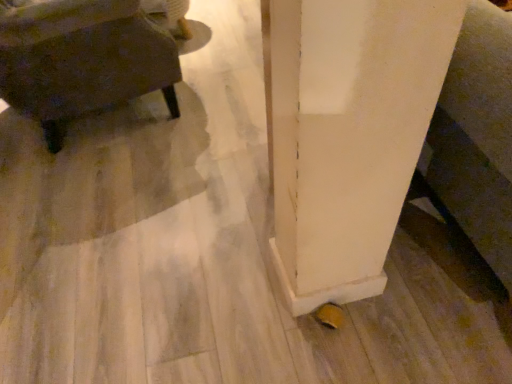
Question: Does white matte pillar at lower right have a smaller size compared to matte dark brown coffee table at left?

Choices:
 (A) no
 (B) yes

Answer: (A)

Question: Is white matte pillar at lower right further to camera compared to matte dark brown coffee table at left?

Choices:
 (A) yes
 (B) no

Answer: (B)

Question: From a real-world perspective, is white matte pillar at lower right below matte dark brown coffee table at left?

Choices:
 (A) yes
 (B) no

Answer: (B)

Question: Is white matte pillar at lower right surrounding matte dark brown coffee table at left?

Choices:
 (A) yes
 (B) no

Answer: (B)

Question: Is white matte pillar at lower right taller than matte dark brown coffee table at left?

Choices:
 (A) no
 (B) yes

Answer: (B)

Question: Is white matte pillar at lower right facing away from matte dark brown coffee table at left?

Choices:
 (A) yes
 (B) no

Answer: (B)

Question: Can we say matte dark brown coffee table at left lies outside white matte pillar at lower right?

Choices:
 (A) no
 (B) yes

Answer: (B)

Question: Is matte dark brown coffee table at left aimed at white matte pillar at lower right?

Choices:
 (A) no
 (B) yes

Answer: (A)

Question: Does matte dark brown coffee table at left contain white matte pillar at lower right?

Choices:
 (A) no
 (B) yes

Answer: (A)

Question: Is matte dark brown coffee table at left further to the viewer compared to white matte pillar at lower right?

Choices:
 (A) no
 (B) yes

Answer: (B)

Question: Does matte dark brown coffee table at left have a lesser height compared to white matte pillar at lower right?

Choices:
 (A) yes
 (B) no

Answer: (A)

Question: Is matte dark brown coffee table at left beside white matte pillar at lower right?

Choices:
 (A) no
 (B) yes

Answer: (A)

Question: In the image, is matte dark brown coffee table at left positioned in front of or behind white matte pillar at lower right?

Choices:
 (A) behind
 (B) front

Answer: (A)